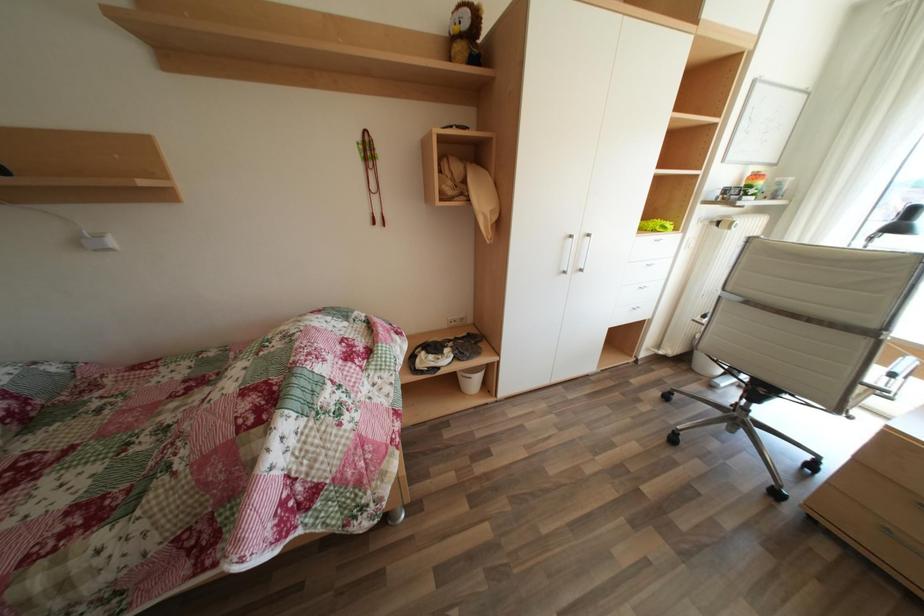
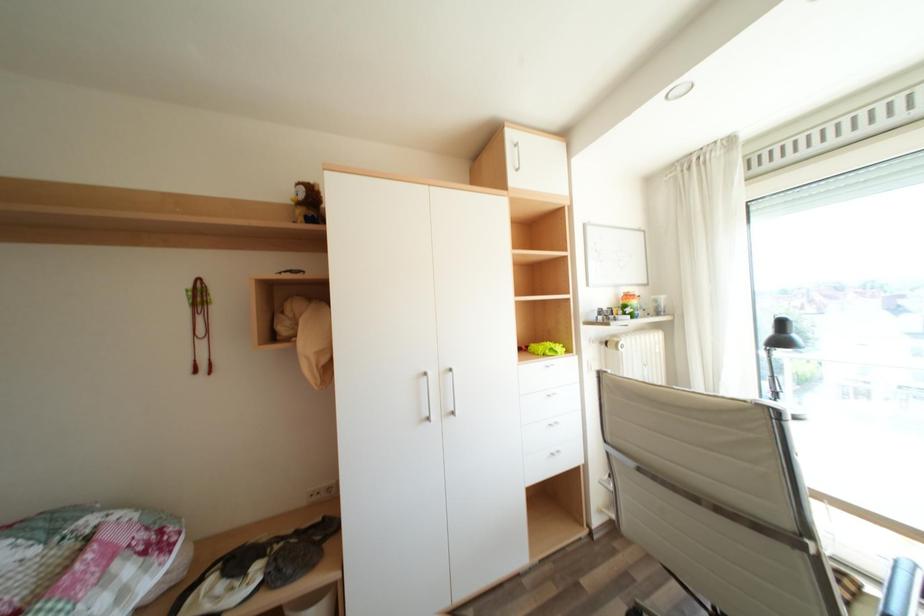
Question: How did the camera likely rotate?

Choices:
 (A) Left
 (B) Right
 (C) Up
 (D) Down

Answer: (C)